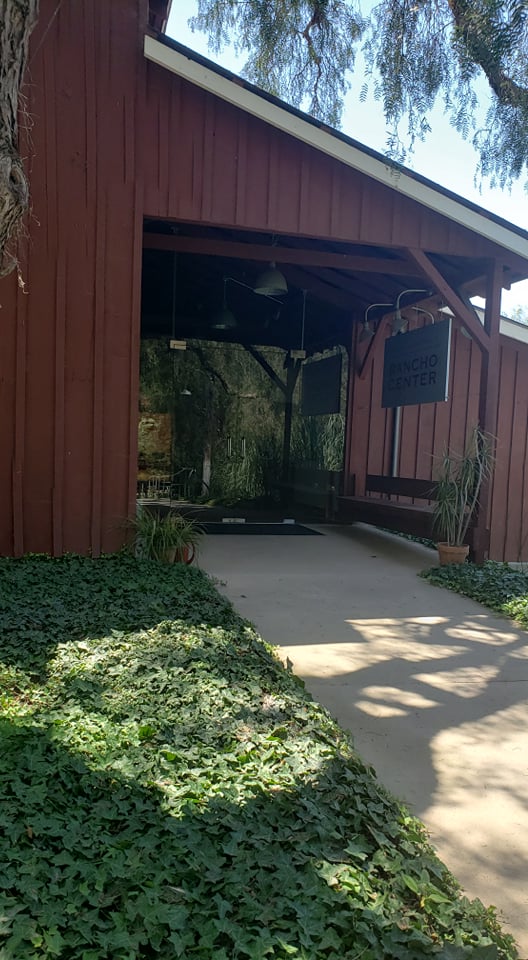
Find the location of a particular element. Image resolution: width=528 pixels, height=960 pixels. lights is located at coordinates (269, 278), (366, 336), (401, 319).